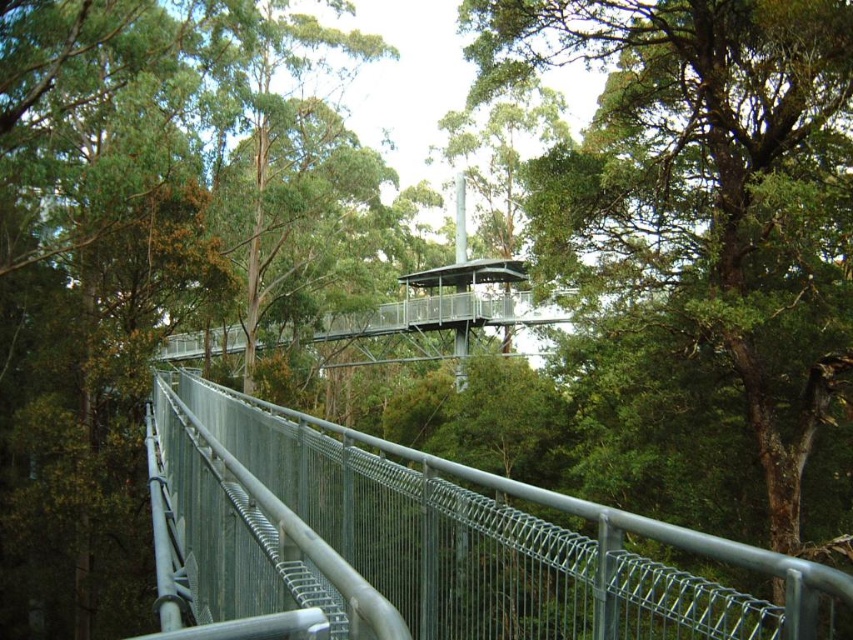
You are a park ranger checking the canopy walkway. You notice the green leafy tree at center and the metal wire mesh fence at center. Which object is shorter?

The green leafy tree at center is shorter than the metal wire mesh fence at center.

You are a park ranger assessing the canopy walkway. You notice the green leafy tree at center and the metal wire mesh fence at center. Which object is wider?

The metal wire mesh fence at center is wider than the green leafy tree at center.

You are a hiker standing on the canopy walkway and notice the green leafy tree at center and the metal wire mesh fence at center. Which object appears taller from your viewpoint?

The metal wire mesh fence at center appears taller than the green leafy tree at center from your viewpoint.